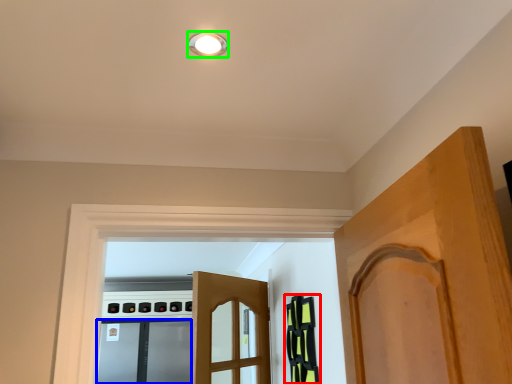
Question: Based on their relative distances, which object is nearer to cabinetry (highlighted by a red box)? Choose from screen door (highlighted by a blue box) and light fixture (highlighted by a green box).

Choices:
 (A) screen door
 (B) light fixture

Answer: (B)